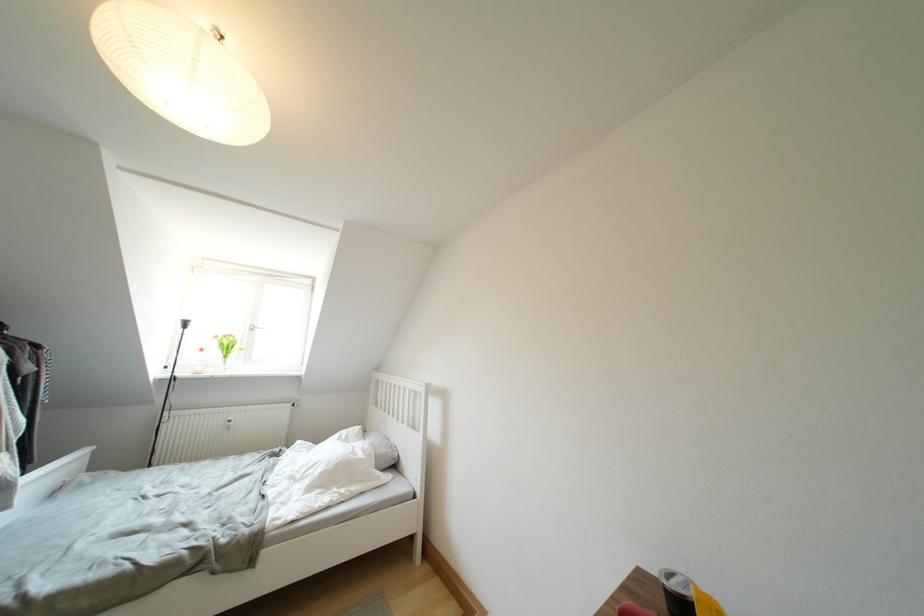
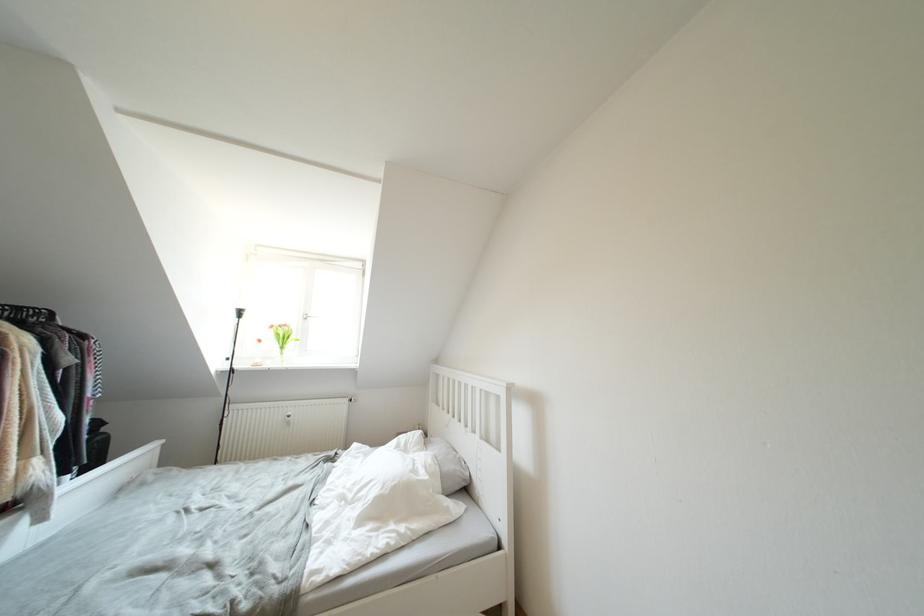
Which direction would the cameraman need to move to produce the second image?

The movement direction of the cameraman is left, forward.